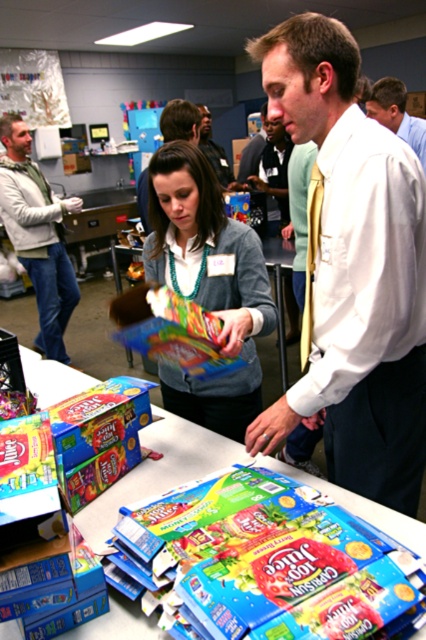
Is matte white shirt at center bigger than matte black shirt at center?

Correct, matte white shirt at center is larger in size than matte black shirt at center.

Is matte white shirt at center shorter than matte black shirt at center?

No.

Who is more forward, (279,129) or (219,148)?

Point (279,129) is more forward.

Locate an element on the screen. matte white shirt at center is located at coordinates (273, 164).

Does matte white sweater at center have a lesser width compared to matte white shirt at center?

No.

Which is more to the right, matte white sweater at center or matte white shirt at center?

matte white shirt at center

Who is more forward, (52, 300) or (267, 176)?

Point (52, 300)

The width and height of the screenshot is (426, 640). Identify the location of matte white sweater at center. (37, 234).

Is blue cardboard boxes at center smaller than matte white shirt at center?

Yes, blue cardboard boxes at center is smaller than matte white shirt at center.

Who is positioned more to the left, blue cardboard boxes at center or matte white shirt at center?

Positioned to the left is blue cardboard boxes at center.

The width and height of the screenshot is (426, 640). Identify the location of blue cardboard boxes at center. 212,472.

You are a GUI agent. You are given a task and a screenshot of the screen. Output one action in this format:
    pyautogui.click(x=<x>, y=<y>)
    Task: Click on the blue cardboard boxes at center
    The image size is (426, 640).
    Given the screenshot: What is the action you would take?
    pyautogui.click(x=212, y=472)